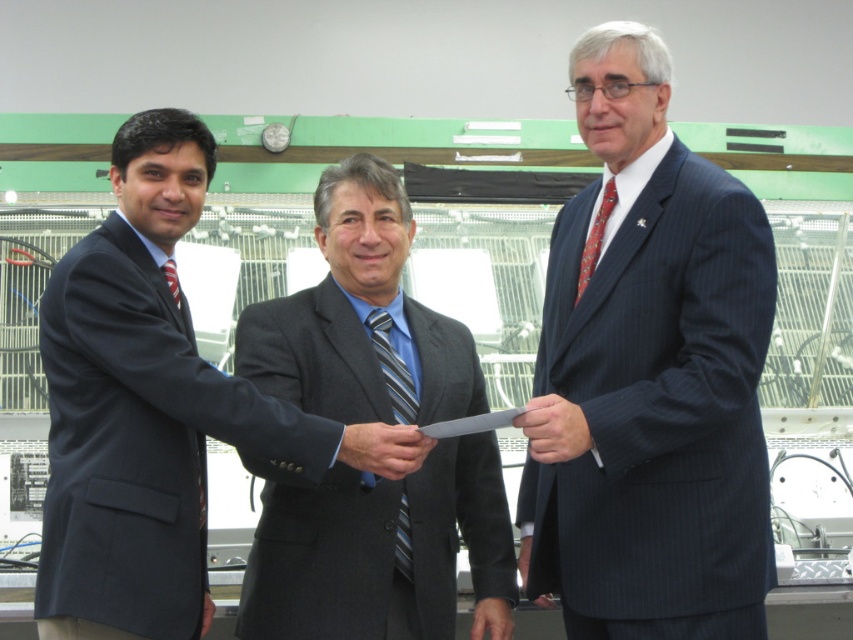
Who is positioned more to the left, pinstriped suit at center or matte black knife at center?

matte black knife at center is more to the left.

Between pinstriped suit at center and matte black knife at center, which one has less height?

Standing shorter between the two is matte black knife at center.

Find the location of a particular element. pinstriped suit at center is located at coordinates (653, 376).

Is point (405, 435) positioned behind point (163, 268)?

That is False.

Between matte black suit at center and matte black tie at left, which one appears on the left side from the viewer's perspective?

Positioned to the left is matte black tie at left.

Identify the location of matte black suit at center. This screenshot has width=853, height=640. (383, 449).

The width and height of the screenshot is (853, 640). In order to click on matte black suit at center in this screenshot , I will do `click(383, 449)`.

Is point (630, 497) behind point (409, 561)?

No, (630, 497) is in front of (409, 561).

Can you confirm if pinstriped suit at center is positioned below striped fabric tie at center?

Incorrect, pinstriped suit at center is not positioned below striped fabric tie at center.

Which is behind, point (610, 122) or point (386, 314)?

Point (386, 314)

I want to click on pinstriped suit at center, so click(653, 376).